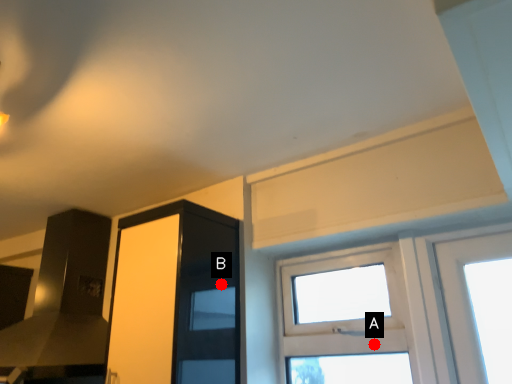
Question: Two points are circled on the image, labeled by A and B beside each circle. Which point appears closest to the camera in this image?

Choices:
 (A) A is closer
 (B) B is closer

Answer: (A)